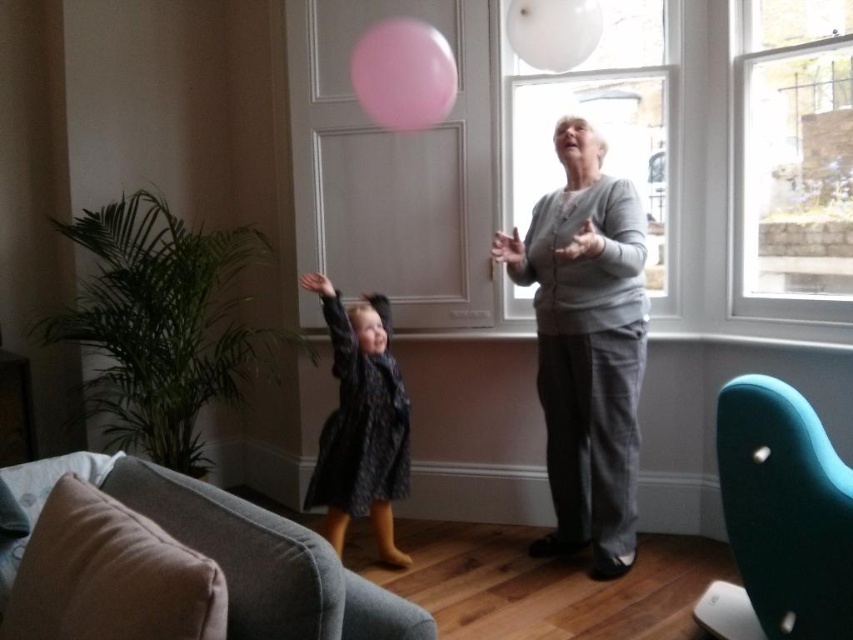
Who is shorter, clear glass window at upper right or fluffy dark blue coat at center?

Standing shorter between the two is fluffy dark blue coat at center.

Locate an element on the screen. clear glass window at upper right is located at coordinates (791, 157).

The width and height of the screenshot is (853, 640). I want to click on clear glass window at upper right, so [x=791, y=157].

Who is higher up, clear glass window at upper right or transparent glass window at upper center?

transparent glass window at upper center is above.

Who is more forward, (813, 298) or (653, 122)?

Point (813, 298) is more forward.

Between point (814, 266) and point (524, 307), which one is positioned in front?

Point (814, 266)

Identify the location of clear glass window at upper right. The image size is (853, 640). coord(791,157).

Who is more forward, (x=538, y=120) or (x=416, y=106)?

Positioned in front is point (x=416, y=106).

Does point (526, 216) come behind point (397, 97)?

Yes, point (526, 216) is behind point (397, 97).

Between point (599, 90) and point (408, 77), which one is positioned behind?

Positioned behind is point (599, 90).

Where is `transparent glass window at upper center`? transparent glass window at upper center is located at coordinates (602, 120).